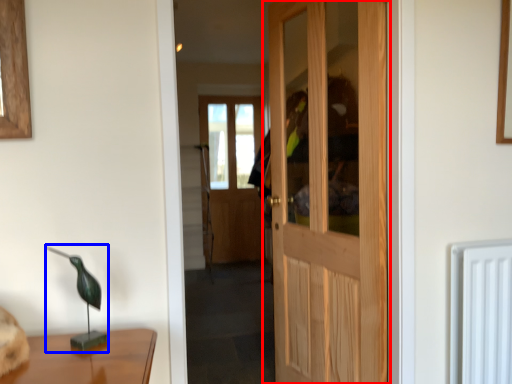
Question: Which of the following is the closest to the observer, door (highlighted by a red box) or table lamp (highlighted by a blue box)?

Choices:
 (A) door
 (B) table lamp

Answer: (B)